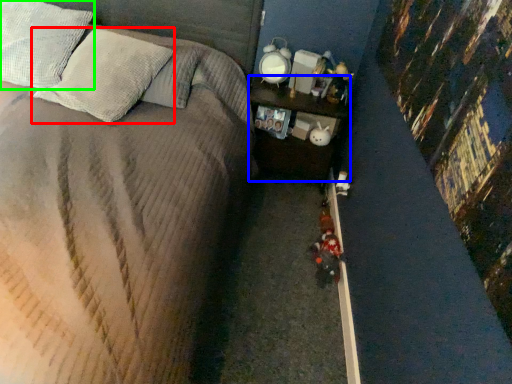
Question: Based on their relative distances, which object is nearer to pillow (highlighted by a red box)? Choose from nightstand (highlighted by a blue box) and pillow (highlighted by a green box).

Choices:
 (A) nightstand
 (B) pillow

Answer: (B)